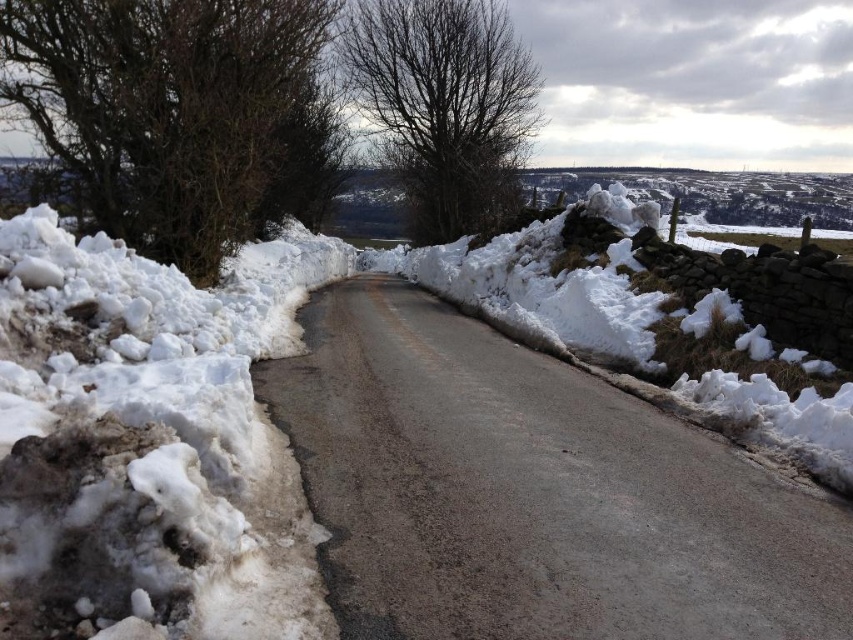
You are standing at the edge of the road in the winter scene. You see two points marked on the road. One is at coordinate point(392, 307) and the other is at point(413, 106). Which point is closer to you?

Point(392, 307) is closer to the viewer than point(413, 106).

You are driving a car that is 15 feet long and want to park it between the gray asphalt road at center and the bare branches at left. Is there enough space between them to park your car?

The distance between the gray asphalt road at center and the bare branches at left is 29.63 feet. Since the car is 15 feet long, there is sufficient space to park between them as 29.63 feet is greater than 15 feet.

You are standing at the point marked as point (178, 115) in the image. What do you see immediately in front of you?

You see bare branches at left immediately in front of you.